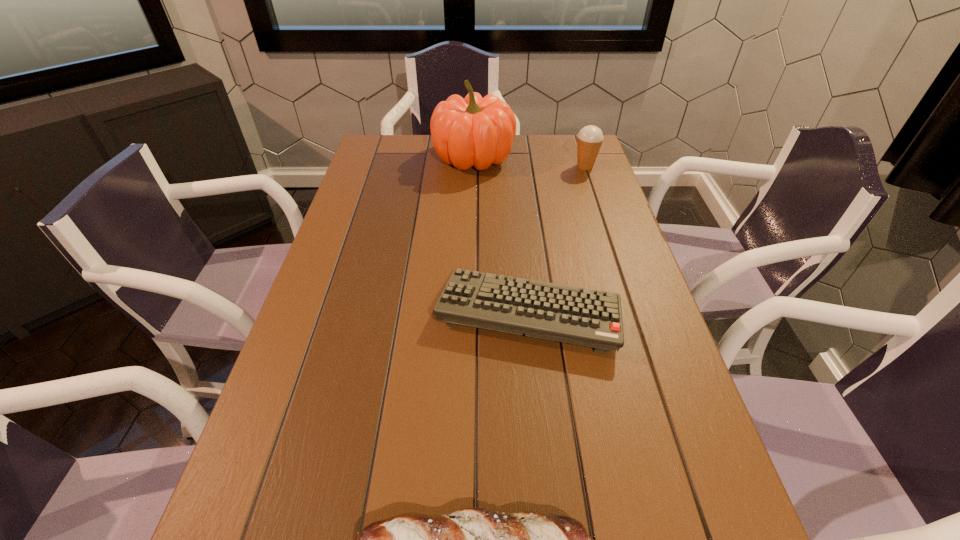
The width and height of the screenshot is (960, 540). Find the location of `object that is the third closest to the baguet`. object that is the third closest to the baguet is located at coordinates (589, 139).

Where is `object that is the closest to the computer keyboard`? This screenshot has width=960, height=540. object that is the closest to the computer keyboard is located at coordinates (471, 539).

Identify the location of vacant space that satisfies the following two spatial constraints: 1. on the front side of the tallest object; 2. on the right side of the second tallest object. (473, 166).

You are a GUI agent. You are given a task and a screenshot of the screen. Output one action in this format:
    pyautogui.click(x=<x>, y=<y>)
    Task: Click on the free space that satisfies the following two spatial constraints: 1. on the front side of the third farthest object; 2. on the left side of the tallest object
    
    Given the screenshot: What is the action you would take?
    [x=470, y=312]

Identify the location of vacant region that satisfies the following two spatial constraints: 1. on the back side of the second nearest object; 2. on the left side of the third shortest object. (514, 166).